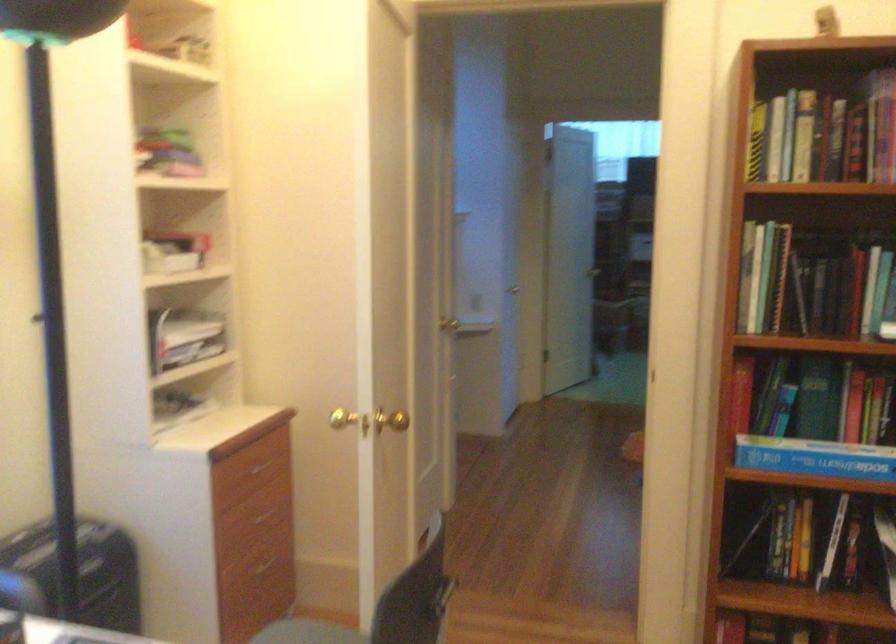
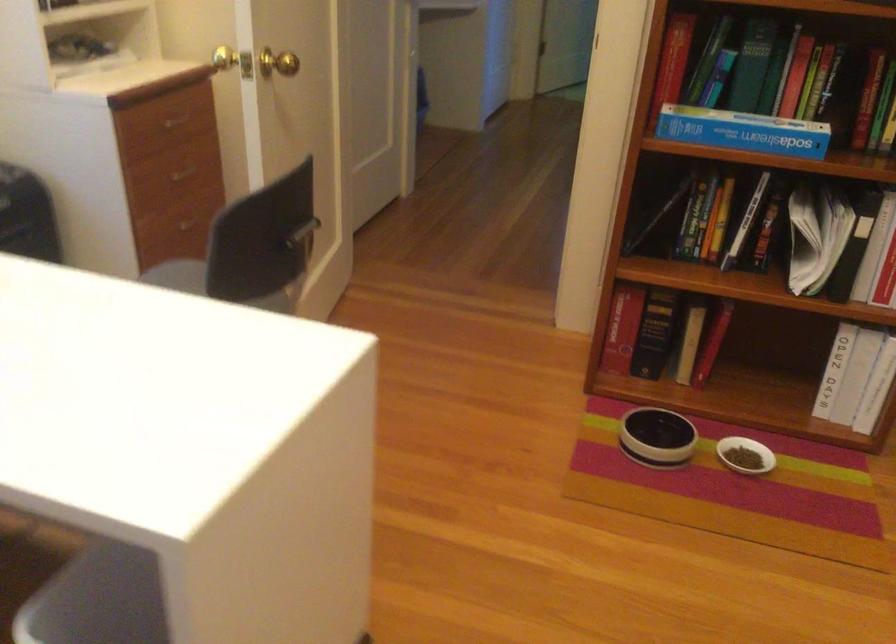
Question: What movement of the cameraman would produce the second image?

Choices:
 (A) Left
 (B) Right
 (C) Forward
 (D) Backward

Answer: (B)